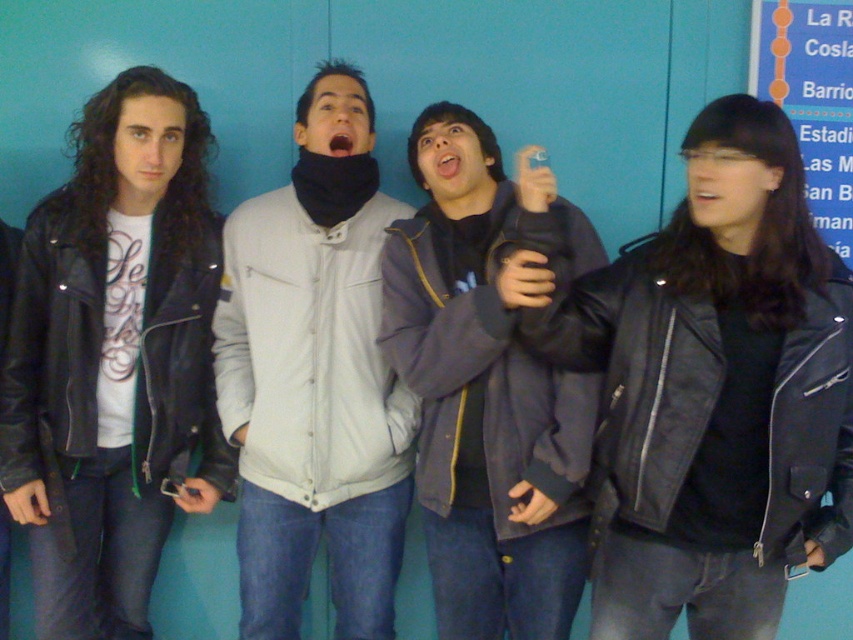
You are looking at the image of two jackets. The matte black leather jacket at left and the light gray fabric jacket at center. Which jacket is positioned lower in the image?

The matte black leather jacket at left is positioned lower because it is below the light gray fabric jacket at center.